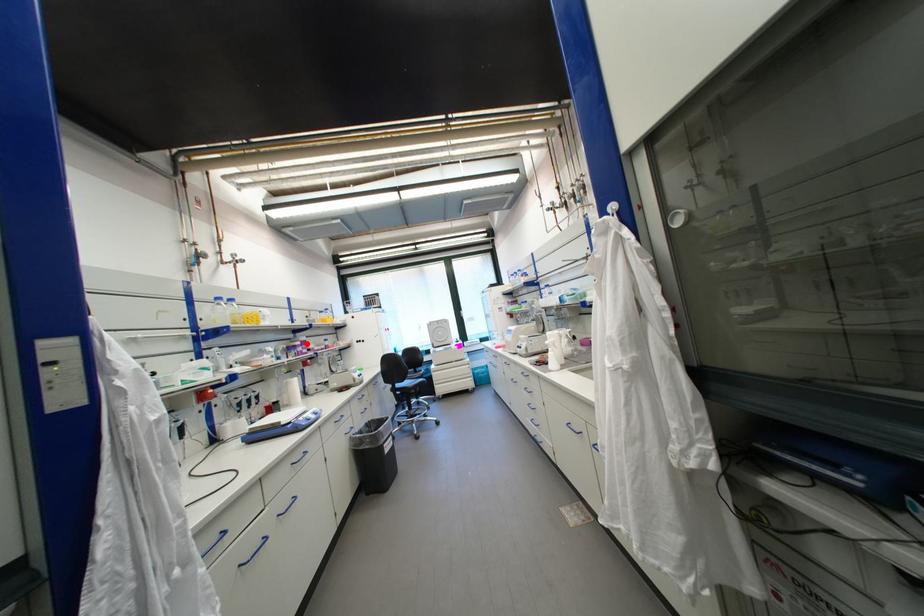
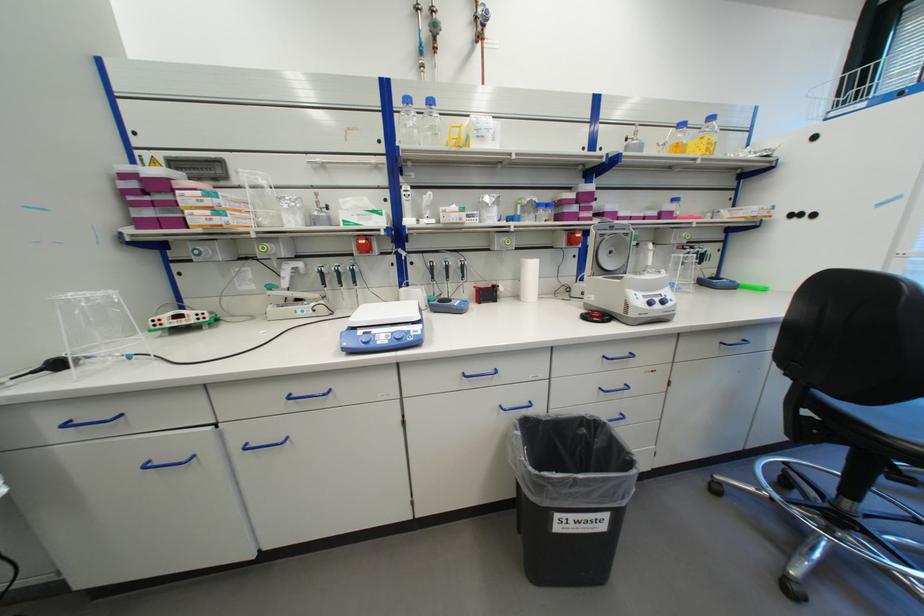
Where in the second image is the point corresponding to the highlighted location from the first image?

(579, 197)